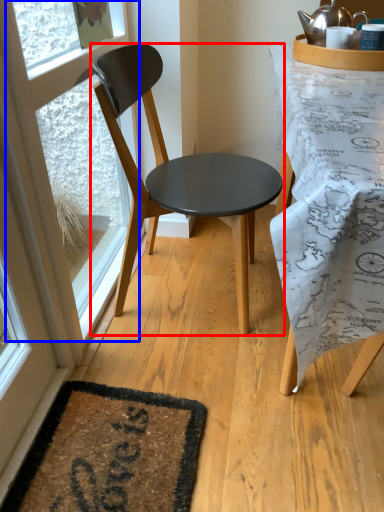
Question: Among these objects, which one is farthest to the camera, chair (highlighted by a red box) or window frame (highlighted by a blue box)?

Choices:
 (A) chair
 (B) window frame

Answer: (B)